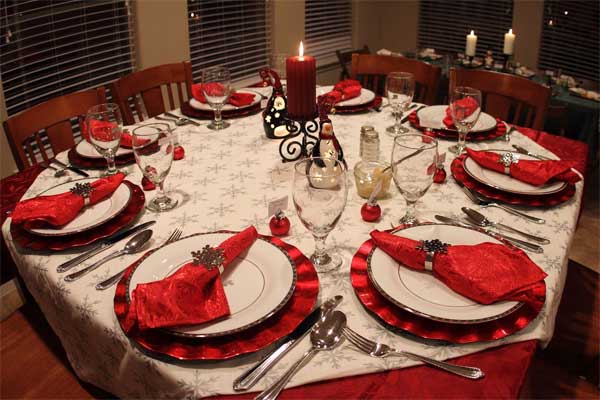
The height and width of the screenshot is (400, 600). In order to click on red napkins in this screenshot , I will do `click(184, 276)`, `click(43, 193)`, `click(84, 123)`, `click(200, 87)`, `click(330, 91)`, `click(448, 115)`, `click(488, 152)`, `click(470, 267)`.